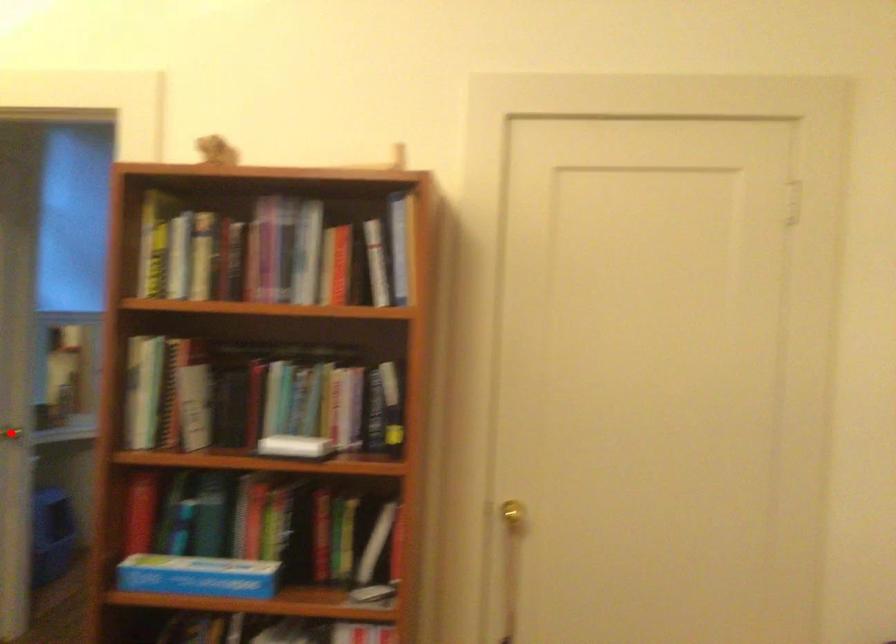
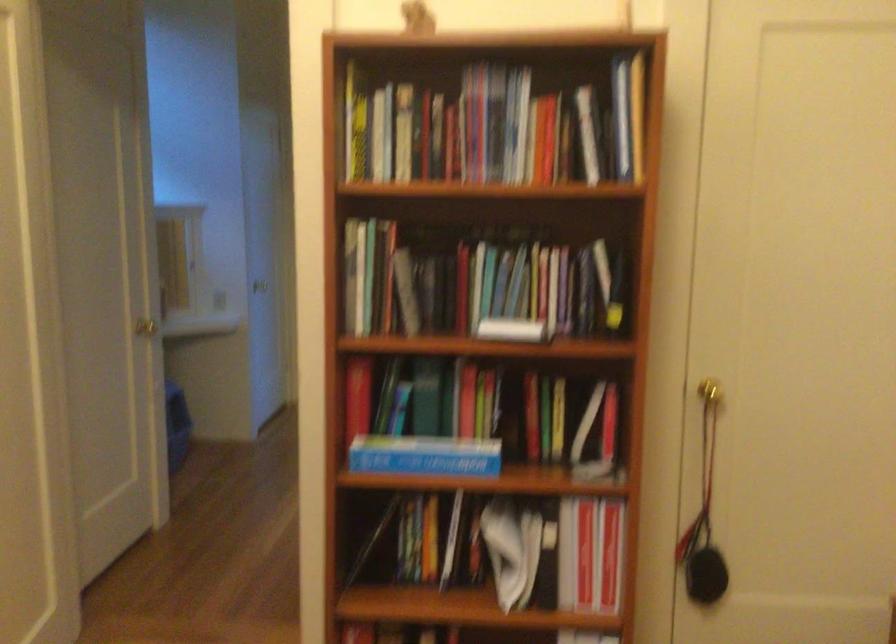
Question: I am providing you with two images of the same scene from different viewpoints. A red point is shown in image1. For the corresponding object point in image2, is it positioned nearer or farther from the camera?

Choices:
 (A) Nearer
 (B) Farther

Answer: (B)